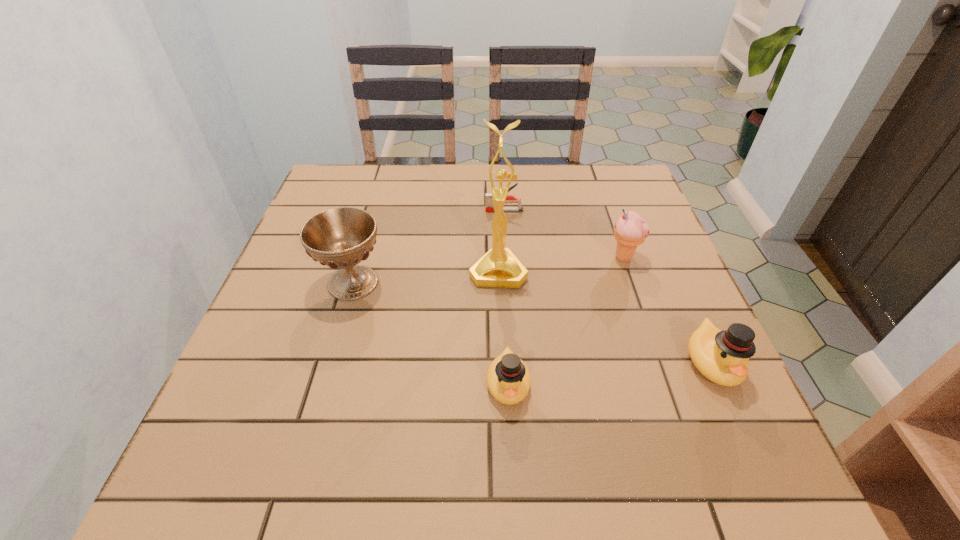
Locate an element on the screen. the shorter duck is located at coordinates (508, 378).

In order to click on the third shortest object in this screenshot , I will do (x=721, y=356).

Where is `the right duck`? Image resolution: width=960 pixels, height=540 pixels. the right duck is located at coordinates (721, 356).

At what (x,y) coordinates should I click in order to perform the action: click on the farthest object. Please return your answer as a coordinate pair (x, y). This screenshot has width=960, height=540. Looking at the image, I should click on (489, 206).

I want to click on chalice, so click(x=342, y=237).

At what (x,y) coordinates should I click in order to perform the action: click on the second object from right to left. Please return your answer as a coordinate pair (x, y). The height and width of the screenshot is (540, 960). Looking at the image, I should click on (630, 230).

I want to click on award, so click(499, 267).

Locate an element on the screen. This screenshot has width=960, height=540. blank space located 0.080m on the handle side of the stapler is located at coordinates (456, 211).

Where is `vacant space located on the handle side of the stapler`? The height and width of the screenshot is (540, 960). vacant space located on the handle side of the stapler is located at coordinates (423, 211).

I want to click on free space located on the handle side of the stapler, so click(x=387, y=211).